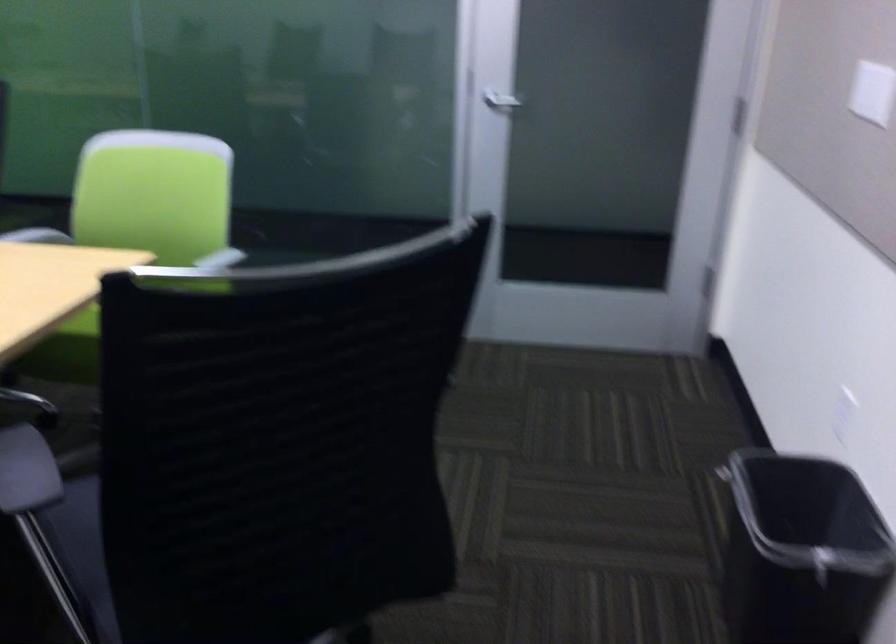
Find where to push the white light switch. Please return your answer as a coordinate pair (x, y).

(872, 91)